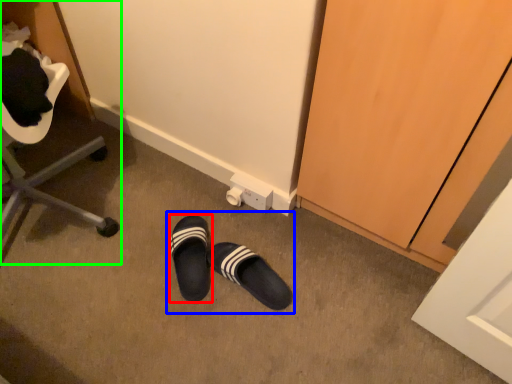
Question: Which object is the farthest from footwear (highlighted by a red box)? Choose among these: leather shoe (highlighted by a blue box) or furniture (highlighted by a green box).

Choices:
 (A) leather shoe
 (B) furniture

Answer: (B)